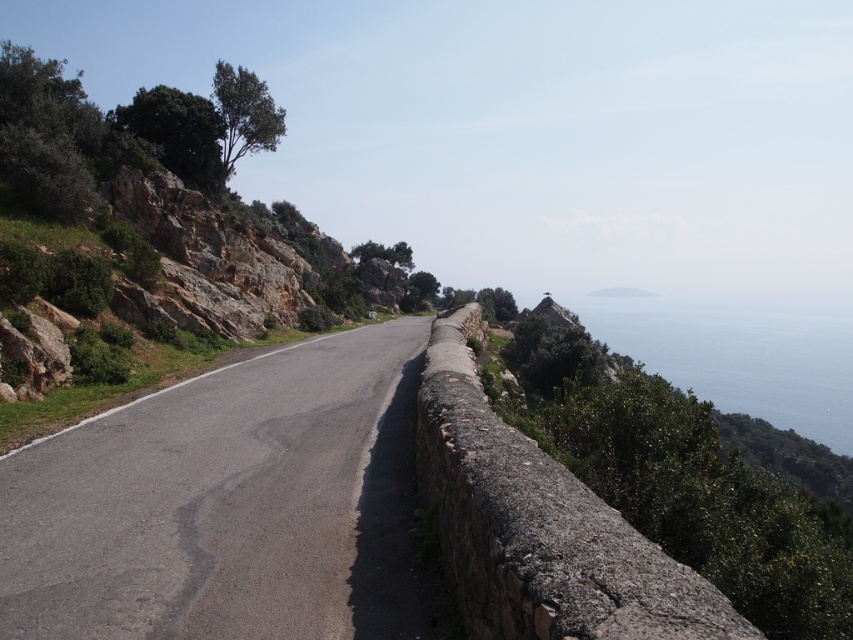
Question: Among these objects, which one is nearest to the camera?

Choices:
 (A) asphalt road at center
 (B) blue water at upper right

Answer: (A)

Question: Which point is closer to the camera?

Choices:
 (A) blue water at upper right
 (B) asphalt road at center

Answer: (B)

Question: Is asphalt road at center in front of blue water at upper right?

Choices:
 (A) yes
 (B) no

Answer: (A)

Question: Can you confirm if asphalt road at center is thinner than blue water at upper right?

Choices:
 (A) yes
 (B) no

Answer: (A)

Question: Is asphalt road at center above blue water at upper right?

Choices:
 (A) yes
 (B) no

Answer: (B)